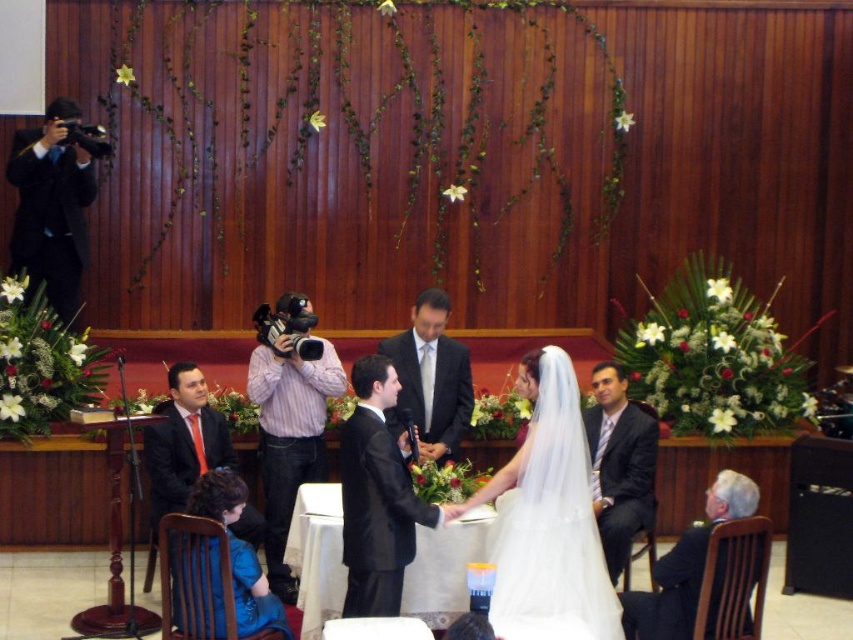
You are a photographer at a wedding and need to ensure both the black satin suit at center and the pink striped shirt at center are fully visible in the frame. Given their sizes, which one might require you to adjust your camera angle to capture entirely?

The black satin suit at center occupies less space than the pink striped shirt at center, so the pink striped shirt at center might require adjusting the camera angle to ensure it fits entirely in the frame.